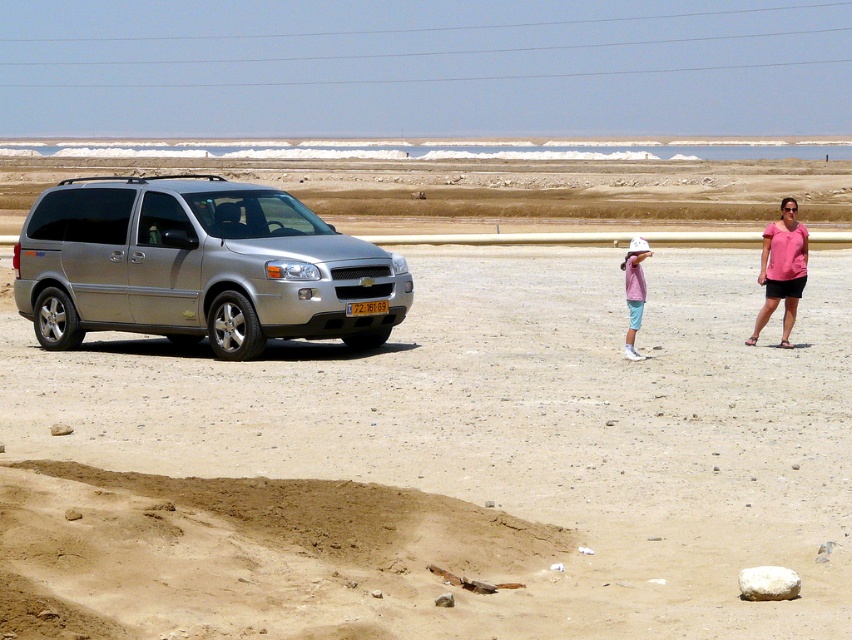
Question: Which of these objects is positioned farthest from the pink fabric shirt at center?

Choices:
 (A) sandy beige at left
 (B) silver metallic minivan at left

Answer: (A)

Question: Can you confirm if sandy beige at left is bigger than silver metallic minivan at left?

Choices:
 (A) yes
 (B) no

Answer: (A)

Question: Is sandy beige at left smaller than silver metallic minivan at left?

Choices:
 (A) no
 (B) yes

Answer: (A)

Question: Which object is positioned farthest from the silver metallic minivan at left?

Choices:
 (A) sandy beige at left
 (B) pink fabric shirt at right

Answer: (B)

Question: Among these points, which one is farthest from the camera?

Choices:
 (A) (630, 349)
 (B) (315, 273)
 (C) (786, 285)
 (D) (235, 545)

Answer: (C)

Question: Can you confirm if silver metallic minivan at left is thinner than pink fabric shirt at center?

Choices:
 (A) yes
 (B) no

Answer: (B)